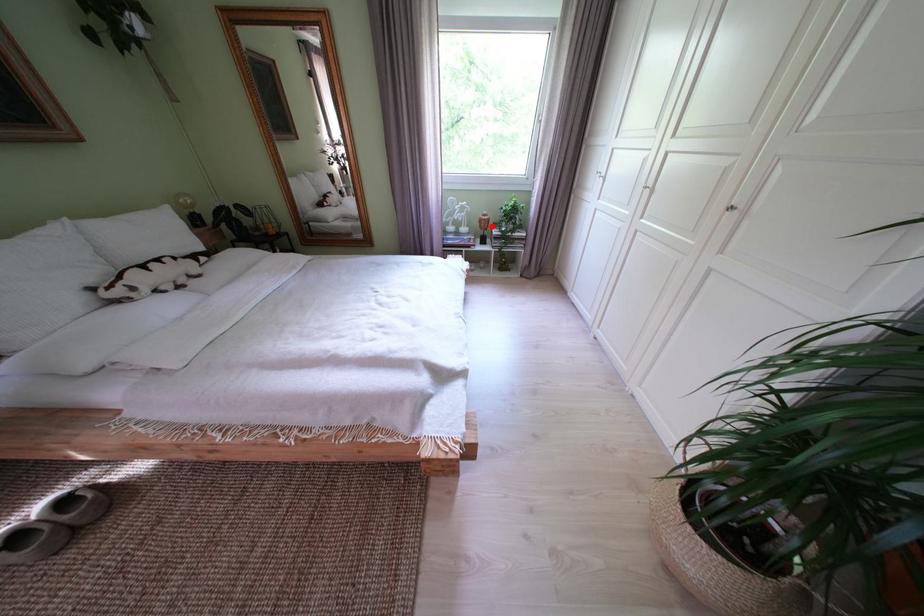
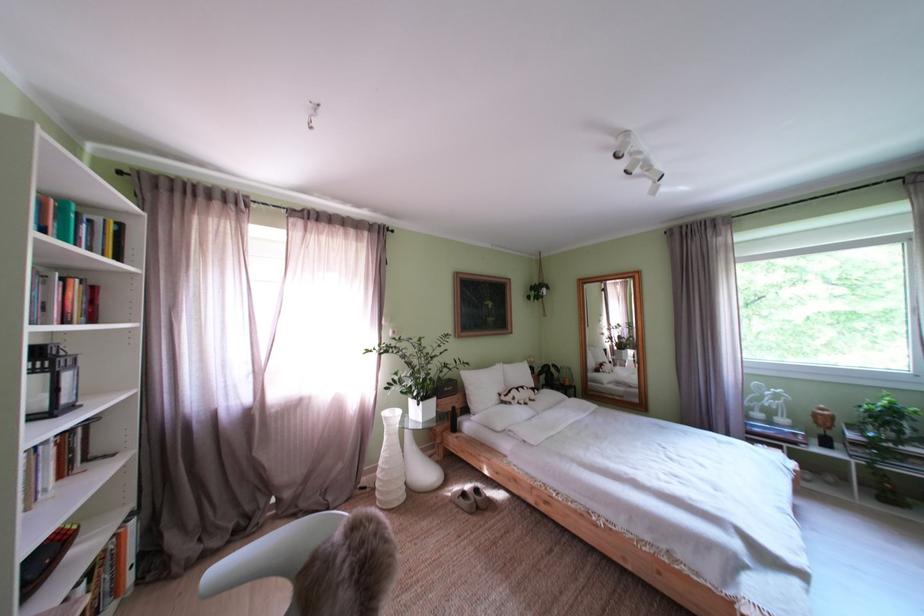
Question: I am providing you with two images of the same scene from different viewpoints. A red point is shown in image1. For the corresponding object point in image2, is it positioned nearer or farther from the camera?

Choices:
 (A) Nearer
 (B) Farther

Answer: (B)